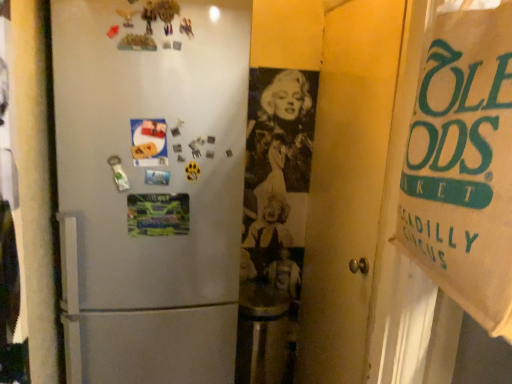
From the picture: What is the approximate width of matte paper postcard at center left, the second postcard positioned from the bottom?

It is 3.72 centimeters.

Where is `brown paper bag at right`? brown paper bag at right is located at coordinates (463, 166).

Considering the sizes of objects multicolored paper at center, which is counted as the second postcard, starting from the top, and matte paper postcard at center left, arranged as the 1th postcard when viewed from the top, in the image provided, who is bigger, multicolored paper at center, which is counted as the second postcard, starting from the top, or matte paper postcard at center left, arranged as the 1th postcard when viewed from the top,?

multicolored paper at center, which is counted as the second postcard, starting from the top.

Does multicolored paper at center, which is counted as the second postcard, starting from the top, have a greater width compared to matte paper postcard at center left, the second postcard positioned from the bottom?

Incorrect, the width of multicolored paper at center, which is counted as the second postcard, starting from the top, does not surpass that of matte paper postcard at center left, the second postcard positioned from the bottom.

Does multicolored paper at center, which is the 1th postcard in bottom-to-top order, appear on the left side of matte paper postcard at center left, arranged as the 1th postcard when viewed from the top?

No.

Considering the sizes of objects multicolored paper at center, which is counted as the second postcard, starting from the top, and matte paper postcard at center left, the second postcard positioned from the bottom, in the image provided, who is taller, multicolored paper at center, which is counted as the second postcard, starting from the top, or matte paper postcard at center left, the second postcard positioned from the bottom,?

matte paper postcard at center left, the second postcard positioned from the bottom, is taller.

Is brown paper bag at right wider or thinner than matte paper postcard at center left, arranged as the 1th postcard when viewed from the top?

In the image, brown paper bag at right appears to be wider than matte paper postcard at center left, arranged as the 1th postcard when viewed from the top.

Are brown paper bag at right and matte paper postcard at center left, the second postcard positioned from the bottom, far apart?

They are positioned close to each other.

The height and width of the screenshot is (384, 512). In order to click on poster in front of the matte paper postcard at center left, arranged as the 1th postcard when viewed from the top in this screenshot , I will do (x=463, y=166).

Based on the photo, from a real-world perspective, is brown paper bag at right on matte paper postcard at center left, the second postcard positioned from the bottom?

Indeed, from a real-world perspective, brown paper bag at right stands above matte paper postcard at center left, the second postcard positioned from the bottom.

Which of these two, multicolored paper at center, which is counted as the second postcard, starting from the top, or brown paper bag at right, is thinner?

multicolored paper at center, which is counted as the second postcard, starting from the top, is thinner.

Is multicolored paper at center, which is counted as the second postcard, starting from the top, to the left of brown paper bag at right from the viewer's perspective?

Yes.

Is there a large distance between multicolored paper at center, which is the 1th postcard in bottom-to-top order, and brown paper bag at right?

That's not correct — multicolored paper at center, which is the 1th postcard in bottom-to-top order, is a little close to brown paper bag at right.

From the image's perspective, between matte paper postcard at center left, the second postcard positioned from the bottom, and multicolored paper at center, which is counted as the second postcard, starting from the top, who is located below?

multicolored paper at center, which is counted as the second postcard, starting from the top, is shown below in the image.

From a real-world perspective, which is physically above, matte paper postcard at center left, arranged as the 1th postcard when viewed from the top, or multicolored paper at center, which is counted as the second postcard, starting from the top?

In real-world perspective, matte paper postcard at center left, arranged as the 1th postcard when viewed from the top, is above.

Is point (137, 162) less distant than point (137, 229)?

Yes, point (137, 162) is closer to viewer.

Does matte paper postcard at center left, the second postcard positioned from the bottom, appear on the left side of multicolored paper at center, which is the 1th postcard in bottom-to-top order?

Yes, matte paper postcard at center left, the second postcard positioned from the bottom, is to the left of multicolored paper at center, which is the 1th postcard in bottom-to-top order.

In the scene shown: From the image's perspective, is matte paper postcard at center left, arranged as the 1th postcard when viewed from the top, above brown paper bag at right?

Yes, from the image's perspective, matte paper postcard at center left, arranged as the 1th postcard when viewed from the top, is over brown paper bag at right.

Looking at this image, does matte paper postcard at center left, the second postcard positioned from the bottom, have a lesser width compared to brown paper bag at right?

Correct, the width of matte paper postcard at center left, the second postcard positioned from the bottom, is less than that of brown paper bag at right.

The image size is (512, 384). I want to click on the 2nd postcard counting from the left of the brown paper bag at right, so click(x=149, y=142).

How different are the orientations of matte paper postcard at center left, arranged as the 1th postcard when viewed from the top, and brown paper bag at right in degrees?

matte paper postcard at center left, arranged as the 1th postcard when viewed from the top, and brown paper bag at right are facing 6.32 degrees away from each other.

From the brown paper bag at right, count 2nd postcards backward and point to it. Please provide its 2D coordinates.

[(158, 214)]

Can you confirm if brown paper bag at right is taller than multicolored paper at center, which is the 1th postcard in bottom-to-top order?

Yes.

From the image's perspective, which is above, brown paper bag at right or multicolored paper at center, which is counted as the second postcard, starting from the top?

brown paper bag at right appears higher in the image.

In the scene shown: Which object is positioned more to the left, brown paper bag at right or multicolored paper at center, which is the 1th postcard in bottom-to-top order?

Positioned to the left is multicolored paper at center, which is the 1th postcard in bottom-to-top order.

The width and height of the screenshot is (512, 384). I want to click on postcard lying on the right of matte paper postcard at center left, the second postcard positioned from the bottom, so click(158, 214).

Where is `postcard above the brown paper bag at right (from the image's perspective)`? Image resolution: width=512 pixels, height=384 pixels. postcard above the brown paper bag at right (from the image's perspective) is located at coordinates (149, 142).

When comparing their distances from brown paper bag at right, does multicolored paper at center, which is the 1th postcard in bottom-to-top order, or matte paper postcard at center left, the second postcard positioned from the bottom, seem further?

multicolored paper at center, which is the 1th postcard in bottom-to-top order.

From the picture: When comparing their distances from multicolored paper at center, which is counted as the second postcard, starting from the top, does brown paper bag at right or matte paper postcard at center left, arranged as the 1th postcard when viewed from the top, seem further?

The object further to multicolored paper at center, which is counted as the second postcard, starting from the top, is brown paper bag at right.

From the image, which object appears to be farther from brown paper bag at right, matte paper postcard at center left, arranged as the 1th postcard when viewed from the top, or multicolored paper at center, which is counted as the second postcard, starting from the top?

multicolored paper at center, which is counted as the second postcard, starting from the top, is positioned further to the anchor brown paper bag at right.

Looking at the image, which one is located closer to matte paper postcard at center left, arranged as the 1th postcard when viewed from the top, brown paper bag at right or multicolored paper at center, which is counted as the second postcard, starting from the top?

multicolored paper at center, which is counted as the second postcard, starting from the top, lies closer to matte paper postcard at center left, arranged as the 1th postcard when viewed from the top, than the other object.

Looking at the image, which one is located closer to multicolored paper at center, which is counted as the second postcard, starting from the top, matte paper postcard at center left, the second postcard positioned from the bottom, or brown paper bag at right?

matte paper postcard at center left, the second postcard positioned from the bottom, is closer to multicolored paper at center, which is counted as the second postcard, starting from the top.

Looking at the image, which one is located closer to matte paper postcard at center left, the second postcard positioned from the bottom, multicolored paper at center, which is the 1th postcard in bottom-to-top order, or brown paper bag at right?

multicolored paper at center, which is the 1th postcard in bottom-to-top order, is positioned closer to the anchor matte paper postcard at center left, the second postcard positioned from the bottom.

Where is `postcard between brown paper bag at right and multicolored paper at center, which is the 1th postcard in bottom-to-top order, along the z-axis`? Image resolution: width=512 pixels, height=384 pixels. postcard between brown paper bag at right and multicolored paper at center, which is the 1th postcard in bottom-to-top order, along the z-axis is located at coordinates (149, 142).